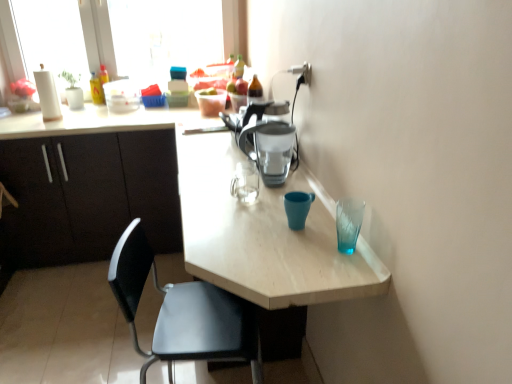
Question: Does point (182, 354) appear closer or farther from the camera than point (267, 152)?

Choices:
 (A) farther
 (B) closer

Answer: (B)

Question: Would you say black plastic chair at lower left is inside or outside matte plastic coffee pot at center?

Choices:
 (A) inside
 (B) outside

Answer: (B)

Question: Estimate the real-world distances between objects in this image. Which object is farther from the matte plastic coffee pot at center?

Choices:
 (A) transparent plastic window at upper left
 (B) matte black cabinets at left
 (C) light wood table at center
 (D) black plastic chair at lower left

Answer: (A)

Question: Estimate the real-world distances between objects in this image. Which object is closer to the matte black cabinets at left?

Choices:
 (A) black plastic chair at lower left
 (B) matte plastic coffee pot at center
 (C) transparent plastic window at upper left
 (D) light wood table at center

Answer: (D)